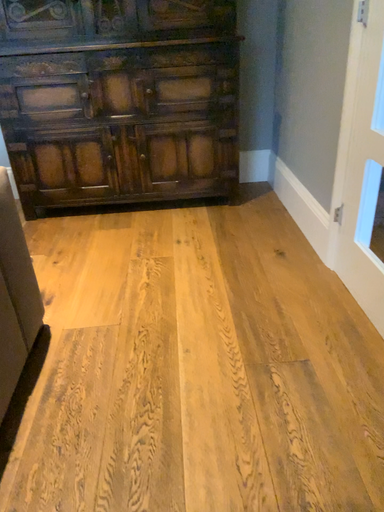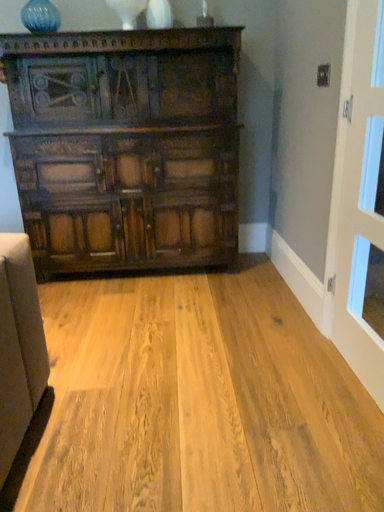
Question: How did the camera likely rotate when shooting the video?

Choices:
 (A) rotated downward
 (B) rotated upward

Answer: (B)